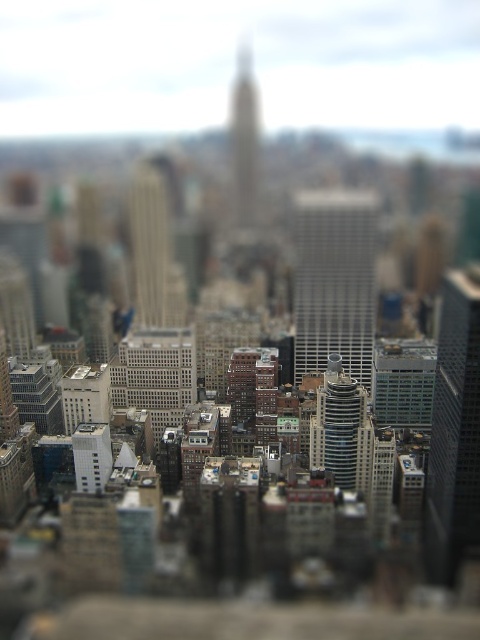
Which is in front, point (337, 188) or point (470, 544)?

Positioned in front is point (337, 188).

Who is positioned more to the left, silver metallic skyscraper at center or glassy skyscraper at right?

silver metallic skyscraper at center is more to the left.

Which is behind, point (315, 218) or point (478, 465)?

Positioned behind is point (478, 465).

Image resolution: width=480 pixels, height=640 pixels. What are the coordinates of `silver metallic skyscraper at center` in the screenshot? It's located at (335, 280).

Between glassy skyscraper at right and shiny silver skyscraper at center, which one appears on the right side from the viewer's perspective?

glassy skyscraper at right is more to the right.

Locate an element on the screen. The width and height of the screenshot is (480, 640). glassy skyscraper at right is located at coordinates (455, 432).

Which is in front, point (479, 456) or point (79, 460)?

Point (479, 456) is more forward.

Is glassy skyscraper at right closer to camera compared to white matte building at center?

No, it is behind white matte building at center.

Who is more distant from viewer, (465, 353) or (108, 428)?

Positioned behind is point (465, 353).

Where is `glassy skyscraper at right`? glassy skyscraper at right is located at coordinates (455, 432).